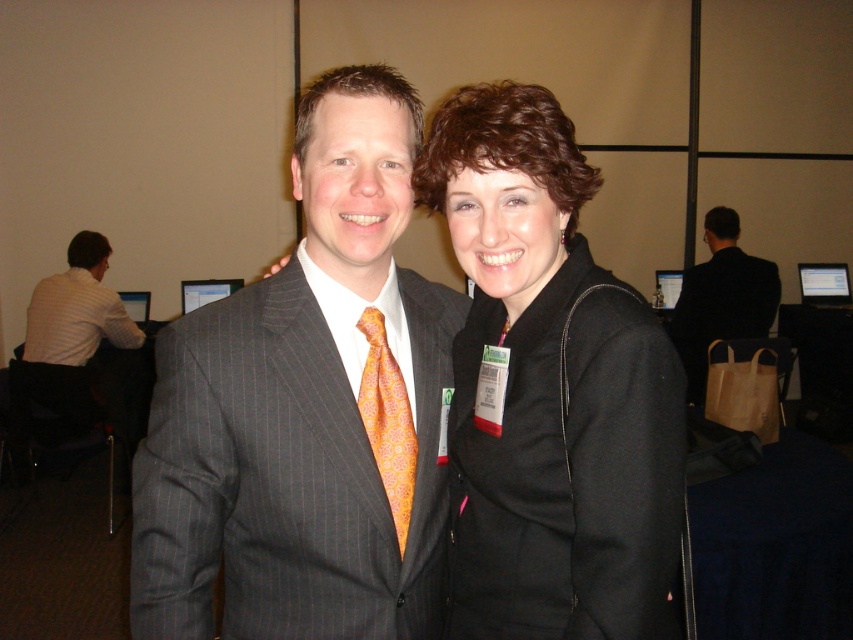
Question: Which point is closer to the camera?

Choices:
 (A) matte pinstripe suit at center
 (B) orange silk tie at center
 (C) black suit at right

Answer: (A)

Question: Does black wool coat at center have a lesser width compared to orange silk tie at center?

Choices:
 (A) yes
 (B) no

Answer: (B)

Question: Does matte pinstripe suit at center appear on the right side of black wool coat at center?

Choices:
 (A) yes
 (B) no

Answer: (B)

Question: Which object is farther from the camera taking this photo?

Choices:
 (A) black suit at right
 (B) matte pinstripe suit at center
 (C) black wool coat at center
 (D) orange silk tie at center

Answer: (A)

Question: Observing the image, what is the correct spatial positioning of matte pinstripe suit at center in reference to black wool coat at center?

Choices:
 (A) below
 (B) above

Answer: (B)

Question: Which of the following is the farthest from the observer?

Choices:
 (A) black wool coat at center
 (B) orange silk tie at center
 (C) matte pinstripe suit at center
 (D) black suit at right

Answer: (D)